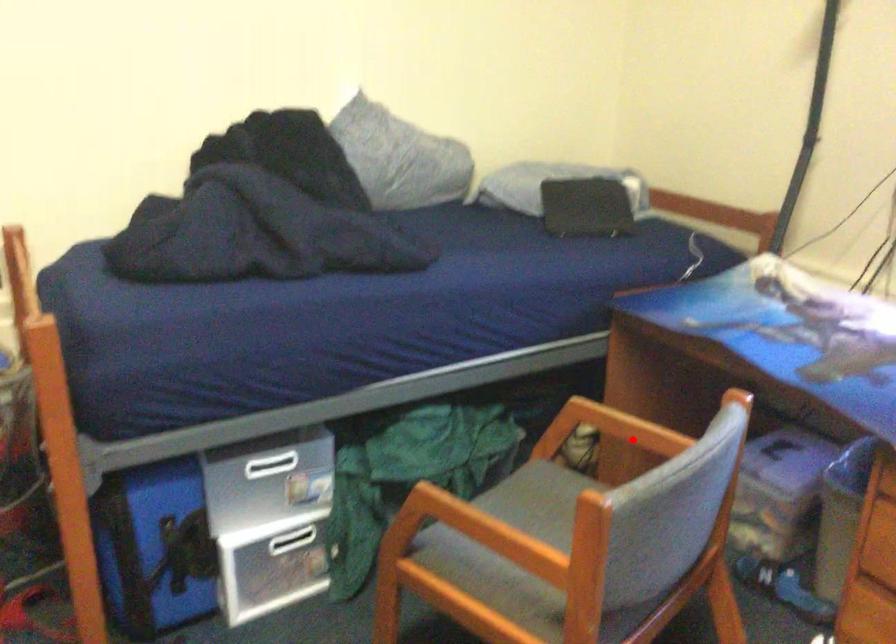
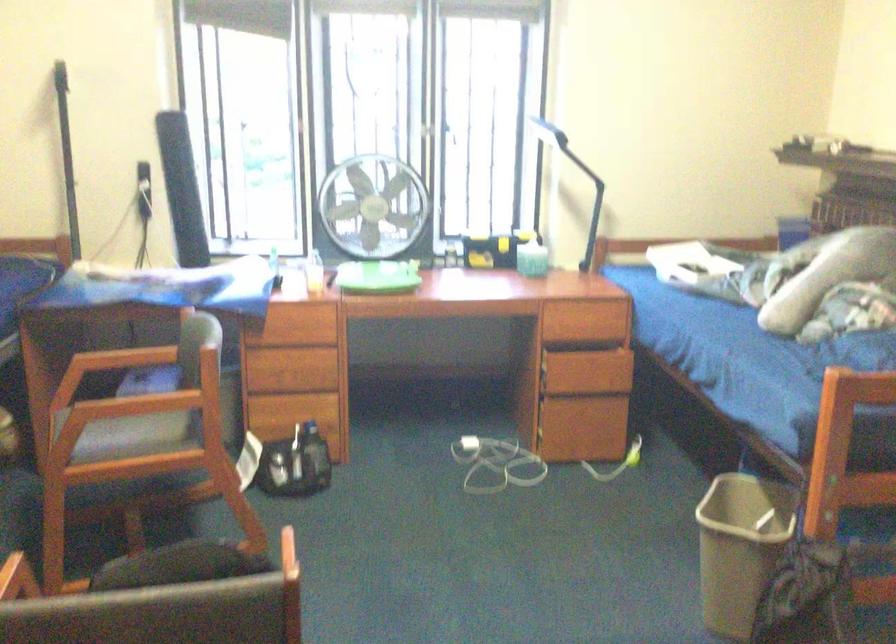
Question: I am providing you with two images of the same scene from different viewpoints. In image1, a red point is highlighted. Considering the same 3D point in image2, which of the following is correct?

Choices:
 (A) It is closer
 (B) It is farther

Answer: (B)